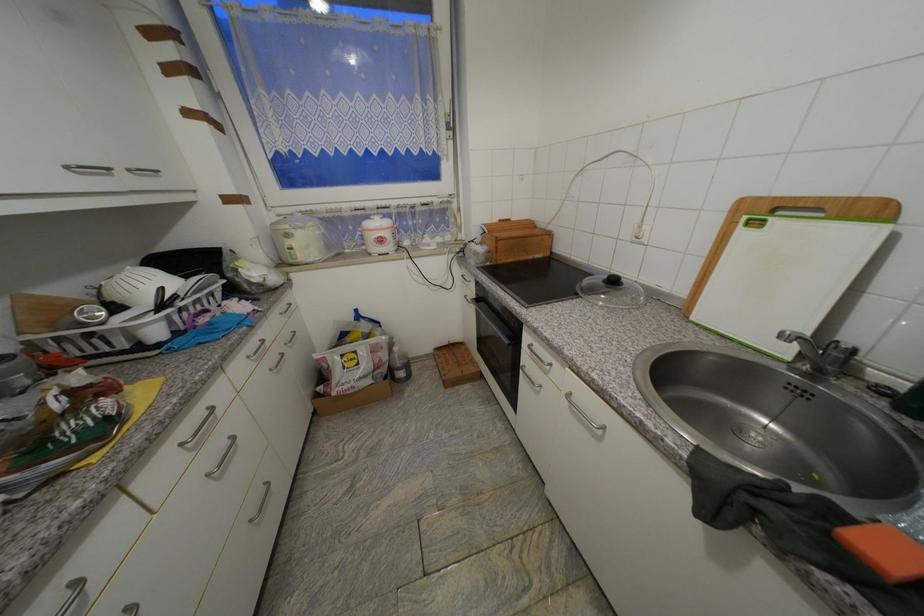
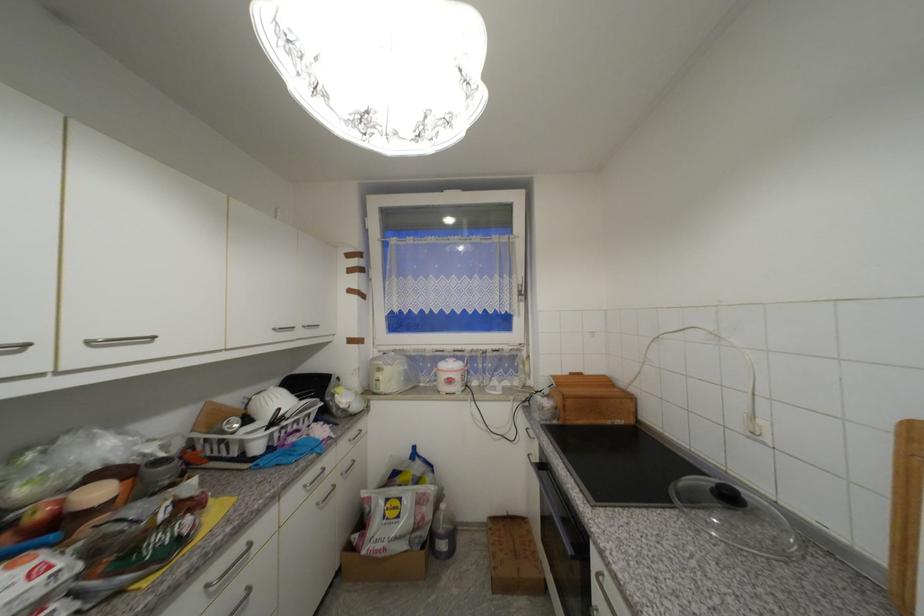
First-person continuous shooting, in which direction is the camera rotating?

The camera rotated toward left-up.